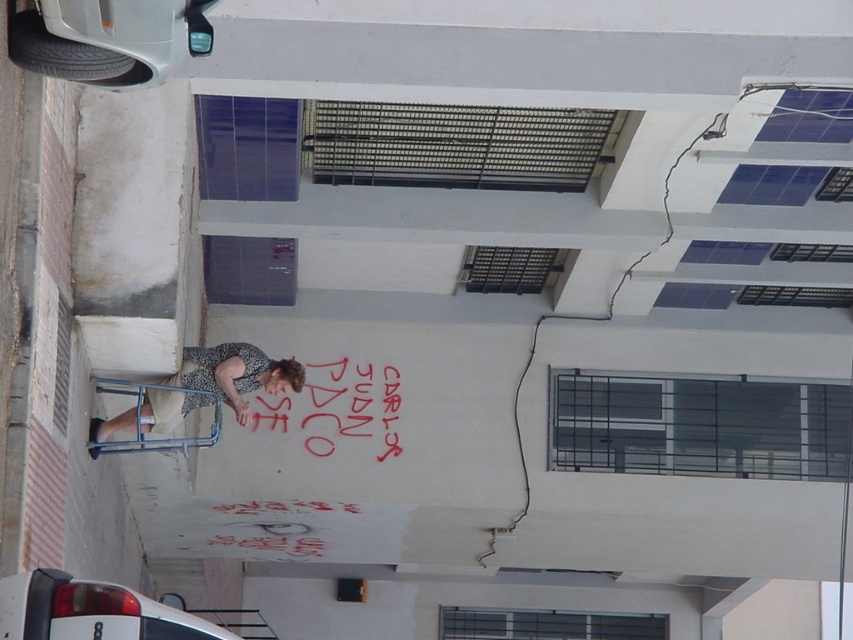
You are a pedestrian standing in front of the building. You see a beige fabric dress at lower left and a red chalk graffiti at center. Which object is closer to the left side of the building?

The beige fabric dress at lower left is closer to the left side of the building because it is positioned to the left of the red chalk graffiti at center.

You are a photographer standing in front of the building. You want to take a photo of the red chalk graffiti at center without the beige fabric dress at lower left blocking it. What should you do?

Move to the side so that the beige fabric dress at lower left is no longer in front of the red chalk graffiti at center. Since the beige fabric dress at lower left is currently in front of the red chalk graffiti at center, moving your position can allow you to capture the graffiti without obstruction.